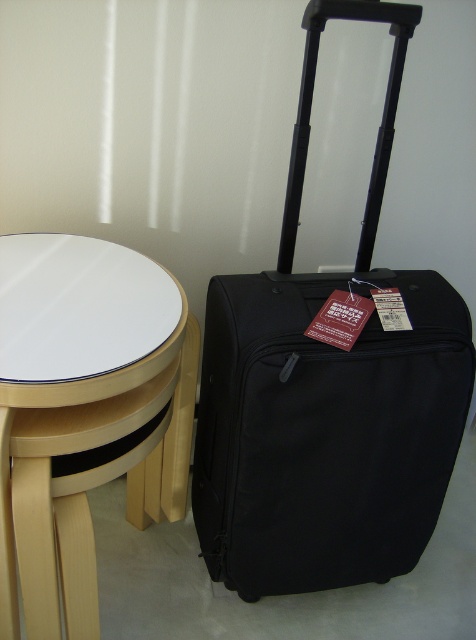
Question: Can you confirm if light wood side table at lower left is thinner than white glossy table at center?

Choices:
 (A) no
 (B) yes

Answer: (A)

Question: Can you confirm if light wood side table at lower left is smaller than white glossy table at center?

Choices:
 (A) no
 (B) yes

Answer: (A)

Question: Estimate the real-world distances between objects in this image. Which object is closer to the white glossy table at center?

Choices:
 (A) light wood side table at lower left
 (B) black hardshell suitcase at right

Answer: (A)

Question: Which object appears farthest from the camera in this image?

Choices:
 (A) light wood side table at lower left
 (B) white glossy table at center
 (C) black hardshell suitcase at right

Answer: (C)

Question: Based on their relative distances, which object is farther from the white glossy table at center?

Choices:
 (A) light wood side table at lower left
 (B) black hardshell suitcase at right

Answer: (B)

Question: Considering the relative positions of black hardshell suitcase at right and light wood side table at lower left in the image provided, where is black hardshell suitcase at right located with respect to light wood side table at lower left?

Choices:
 (A) right
 (B) left

Answer: (A)